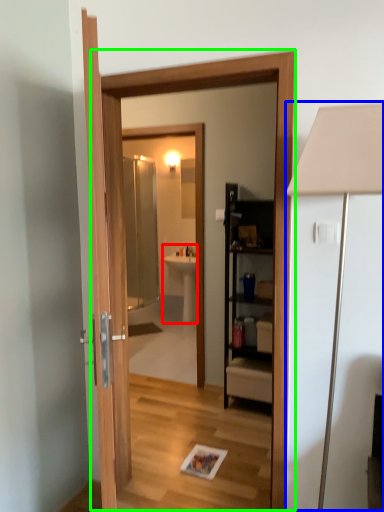
Question: Which is nearer to the sink (highlighted by a red box)? table lamp (highlighted by a blue box) or screen door (highlighted by a green box).

Choices:
 (A) table lamp
 (B) screen door

Answer: (B)